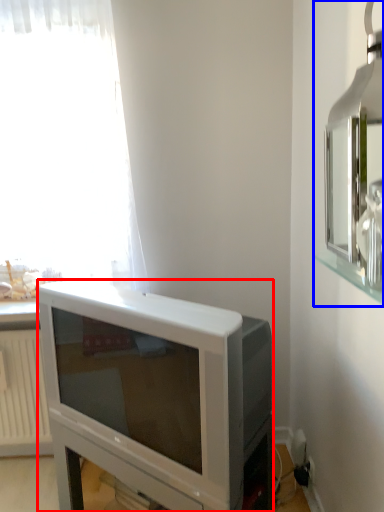
Question: Which of the following is the closest to the observer, television (highlighted by a red box) or medicine cabinet (highlighted by a blue box)?

Choices:
 (A) television
 (B) medicine cabinet

Answer: (B)